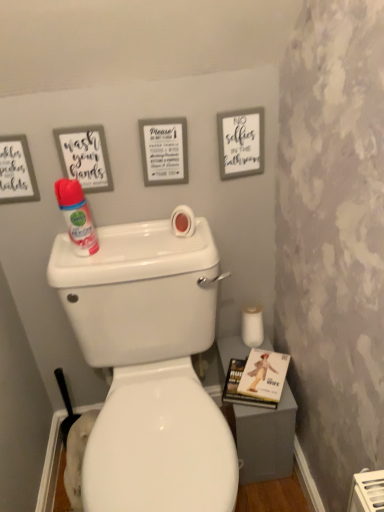
At what (x,y) coordinates should I click in order to perform the action: click on free space in front of matte pink spray bottle at left. Please return your answer as a coordinate pair (x, y). This screenshot has height=512, width=384. Looking at the image, I should click on (89, 270).